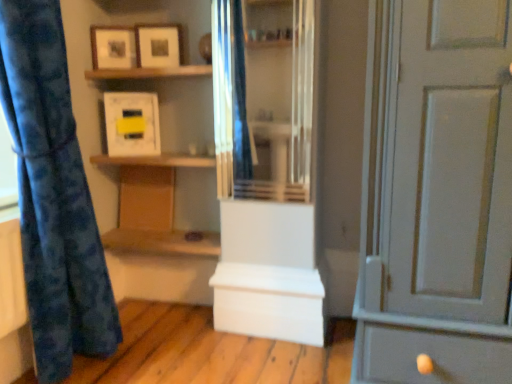
Question: Should I look upward or downward to see wooden shelf at upper center, arranged as the 1th shelf when viewed from the top?

Choices:
 (A) down
 (B) up

Answer: (B)

Question: Is matte white picture frame at upper center, placed as the third picture frame when sorted from bottom to top, thinner than white matte storage box at center, which ranks as the 1th cabinetry in front-to-back order?

Choices:
 (A) no
 (B) yes

Answer: (B)

Question: From a real-world perspective, is matte white picture frame at upper center, which ranks as the 1th picture frame in top-to-bottom order, beneath white matte storage box at center, which is the second cabinetry in top-to-bottom order?

Choices:
 (A) yes
 (B) no

Answer: (B)

Question: Does matte white picture frame at upper center, which ranks as the 1th picture frame in top-to-bottom order, have a greater height compared to white matte storage box at center, positioned as the 2th cabinetry in left-to-right order?

Choices:
 (A) yes
 (B) no

Answer: (B)

Question: Is matte white picture frame at upper center, which ranks as the 1th picture frame in top-to-bottom order, turned away from white matte storage box at center, positioned as the 2th cabinetry in left-to-right order?

Choices:
 (A) no
 (B) yes

Answer: (A)

Question: From the image's perspective, would you say matte white picture frame at upper center, which ranks as the 1th picture frame in top-to-bottom order, is shown under white matte storage box at center, which is the second cabinetry in top-to-bottom order?

Choices:
 (A) yes
 (B) no

Answer: (B)

Question: Is matte white picture frame at upper center, placed as the third picture frame when sorted from bottom to top, bigger than white matte storage box at center, which ranks as the 1th cabinetry in bottom-to-top order?

Choices:
 (A) yes
 (B) no

Answer: (B)

Question: Does blue fabric curtain at left have a lesser width compared to matte white picture frame at upper center, which ranks as the 1th picture frame in top-to-bottom order?

Choices:
 (A) no
 (B) yes

Answer: (A)

Question: From the image's perspective, does blue fabric curtain at left appear higher than matte white picture frame at upper center, which ranks as the 1th picture frame in top-to-bottom order?

Choices:
 (A) no
 (B) yes

Answer: (A)

Question: Could matte white picture frame at upper center, placed as the third picture frame when sorted from bottom to top, be considered to be inside blue fabric curtain at left?

Choices:
 (A) yes
 (B) no

Answer: (B)

Question: Does blue fabric curtain at left come in front of matte white picture frame at upper center, placed as the third picture frame when sorted from bottom to top?

Choices:
 (A) yes
 (B) no

Answer: (A)

Question: Is blue fabric curtain at left to the right of matte white picture frame at upper center, which ranks as the 1th picture frame in top-to-bottom order, from the viewer's perspective?

Choices:
 (A) no
 (B) yes

Answer: (A)

Question: Are blue fabric curtain at left and matte white picture frame at upper center, placed as the third picture frame when sorted from bottom to top, far apart?

Choices:
 (A) yes
 (B) no

Answer: (B)

Question: From the image's perspective, is white matte storage box at center, which ranks as the 1th cabinetry in bottom-to-top order, over matte white picture frame at upper center, arranged as the 3th picture frame when viewed from the top?

Choices:
 (A) yes
 (B) no

Answer: (B)